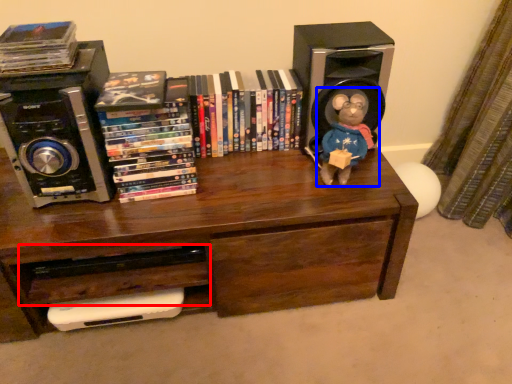
Question: Which of the following is the closest to the observer, drawer (highlighted by a red box) or toy (highlighted by a blue box)?

Choices:
 (A) drawer
 (B) toy

Answer: (B)